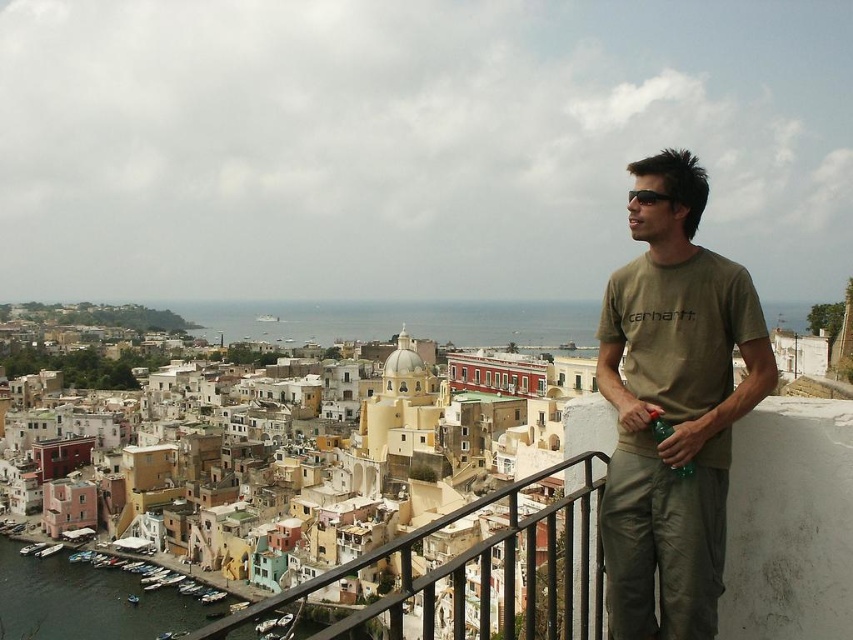
Question: Which object appears farthest from the camera in this image?

Choices:
 (A) matte khaki t-shirt at right
 (B) black metal railing at lower center

Answer: (A)

Question: Observing the image, what is the correct spatial positioning of matte khaki t-shirt at right in reference to black metal railing at lower center?

Choices:
 (A) right
 (B) left

Answer: (A)

Question: In this image, where is matte khaki t-shirt at right located relative to black metal railing at lower center?

Choices:
 (A) below
 (B) above

Answer: (B)

Question: Among these objects, which one is nearest to the camera?

Choices:
 (A) black metal railing at lower center
 (B) matte khaki t-shirt at right

Answer: (A)

Question: Does matte khaki t-shirt at right have a larger size compared to black metal railing at lower center?

Choices:
 (A) no
 (B) yes

Answer: (A)